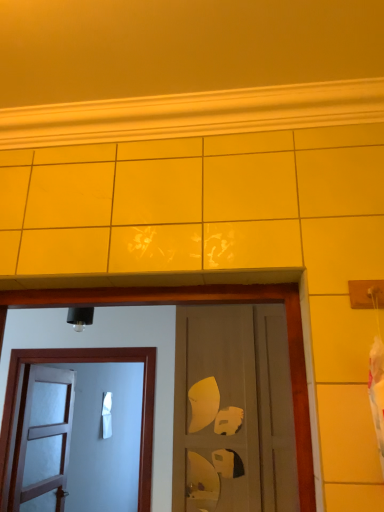
Question: Which direction should I rotate to face matte brown door at center, placed as the 3th door when sorted from left to right, — up or down?

Choices:
 (A) up
 (B) down

Answer: (B)

Question: Is white wooden door at left, placed as the third door when sorted from right to left, turned away from white matte door at left, which appears as the second door when viewed from the right?

Choices:
 (A) yes
 (B) no

Answer: (B)

Question: From a real-world perspective, does white wooden door at left, placed as the third door when sorted from right to left, sit lower than white matte door at left, positioned as the second door in left-to-right order?

Choices:
 (A) yes
 (B) no

Answer: (A)

Question: Does white wooden door at left, placed as the third door when sorted from right to left, have a lesser height compared to white matte door at left, which appears as the second door when viewed from the right?

Choices:
 (A) yes
 (B) no

Answer: (B)

Question: Is white wooden door at left, placed as the third door when sorted from right to left, positioned beyond the bounds of white matte door at left, which appears as the second door when viewed from the right?

Choices:
 (A) no
 (B) yes

Answer: (B)

Question: Does white wooden door at left, placed as the third door when sorted from right to left, appear on the right side of white matte door at left, which appears as the second door when viewed from the right?

Choices:
 (A) yes
 (B) no

Answer: (B)

Question: Is white wooden door at left, arranged as the first door when viewed from the left, wider than white matte door at left, positioned as the second door in left-to-right order?

Choices:
 (A) yes
 (B) no

Answer: (A)

Question: Is matte brown door at center, acting as the 1th door starting from the right, not within white matte door at left, which appears as the second door when viewed from the right?

Choices:
 (A) no
 (B) yes

Answer: (B)

Question: Is matte brown door at center, acting as the 1th door starting from the right, to the right of white matte door at left, which appears as the second door when viewed from the right, from the viewer's perspective?

Choices:
 (A) no
 (B) yes

Answer: (B)

Question: Is matte brown door at center, placed as the 3th door when sorted from left to right, wider than white matte door at left, positioned as the second door in left-to-right order?

Choices:
 (A) no
 (B) yes

Answer: (B)

Question: Is matte brown door at center, placed as the 3th door when sorted from left to right, oriented towards white matte door at left, positioned as the second door in left-to-right order?

Choices:
 (A) no
 (B) yes

Answer: (A)

Question: Does matte brown door at center, acting as the 1th door starting from the right, have a greater height compared to white matte door at left, which appears as the second door when viewed from the right?

Choices:
 (A) yes
 (B) no

Answer: (A)

Question: From a real-world perspective, is matte brown door at center, placed as the 3th door when sorted from left to right, positioned under white matte door at left, positioned as the second door in left-to-right order, based on gravity?

Choices:
 (A) no
 (B) yes

Answer: (A)

Question: Is white wooden door at left, arranged as the first door when viewed from the left, bigger than matte brown door at center, acting as the 1th door starting from the right?

Choices:
 (A) no
 (B) yes

Answer: (A)